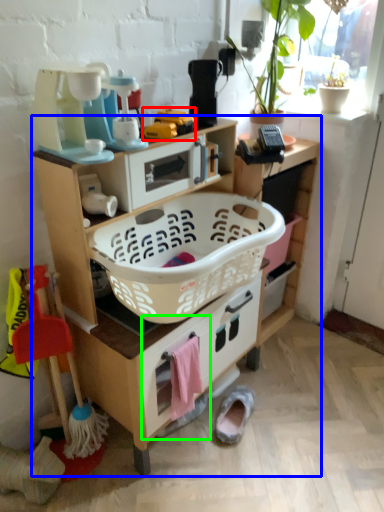
Question: Estimate the real-world distances between objects in this image. Which object is closer to toy (highlighted by a red box), shelf (highlighted by a blue box) or drawer (highlighted by a green box)?

Choices:
 (A) shelf
 (B) drawer

Answer: (A)